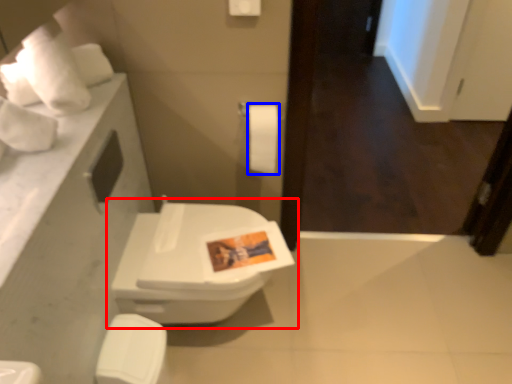
Question: Which object is closer to the camera taking this photo, toilet (highlighted by a red box) or toilet paper (highlighted by a blue box)?

Choices:
 (A) toilet
 (B) toilet paper

Answer: (A)